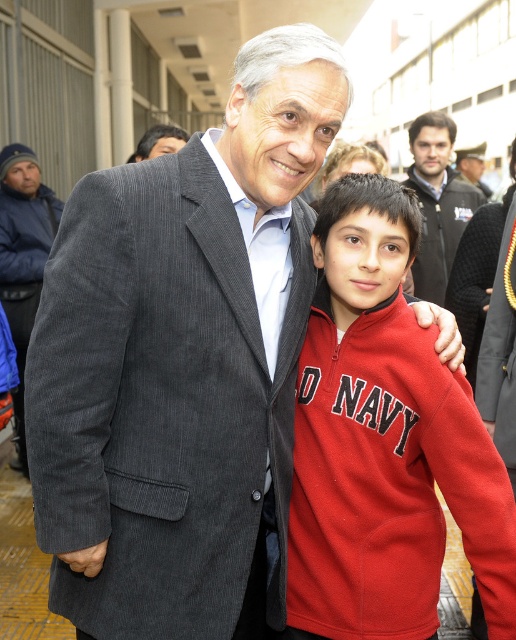
Is red fleece jacket at right smaller than dark blue fleece sweatshirt at left?

Yes.

Is point (375, 461) closer to camera compared to point (20, 220)?

Yes, point (375, 461) is in front of point (20, 220).

Where is `red fleece jacket at right`? This screenshot has width=516, height=640. red fleece jacket at right is located at coordinates (384, 442).

Who is positioned more to the left, dark gray corduroy suit at center or matte black uniform at upper right?

From the viewer's perspective, dark gray corduroy suit at center appears more on the left side.

The height and width of the screenshot is (640, 516). What are the coordinates of `dark gray corduroy suit at center` in the screenshot? It's located at (159, 141).

Who is taller, red fleece jacket at right or dark gray corduroy suit at center?

red fleece jacket at right is taller.

Does point (379, 460) lie behind point (142, 136)?

No, (379, 460) is closer to viewer.

Image resolution: width=516 pixels, height=640 pixels. Describe the element at coordinates (384, 442) in the screenshot. I see `red fleece jacket at right` at that location.

Find the location of a particular element. This screenshot has height=640, width=516. red fleece jacket at right is located at coordinates (384, 442).